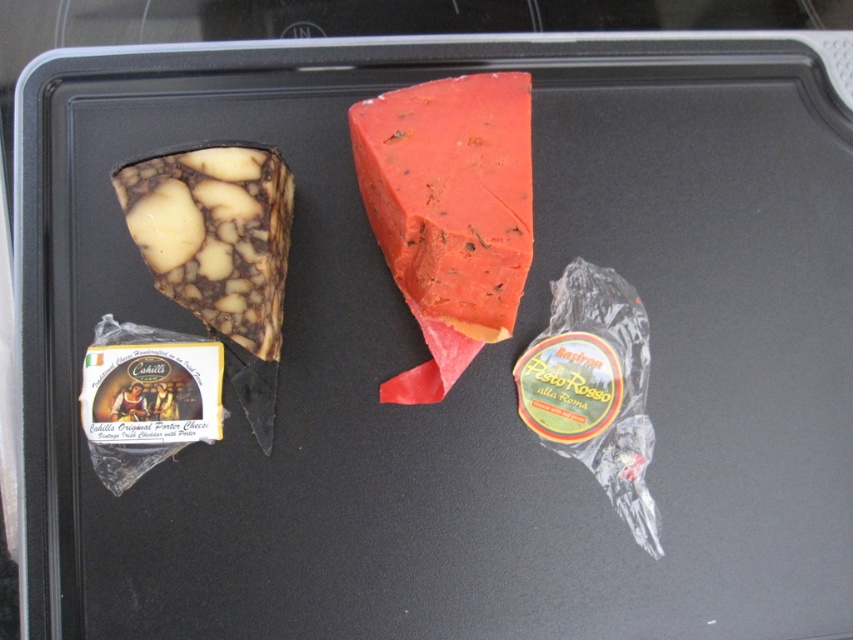
You are a cheese connoisseur who wants to place a 20 cm long cheese knife between the red matte cheese at center and the marbled cheese at left. Is there enough space to fit the knife between them?

The red matte cheese at center is 23.14 centimeters from the marbled cheese at left. Since the knife is 20 cm long, there is sufficient space to place the knife between them.

You are a chef preparing a dish and need to place the red matte cheese at center and the translucent plastic pesto rosso at center onto a small plate. Which one should you place first to ensure proper layering?

The red matte cheese at center should be placed first since it is above the translucent plastic pesto rosso at center in the image, indicating it should be the top layer in the dish.